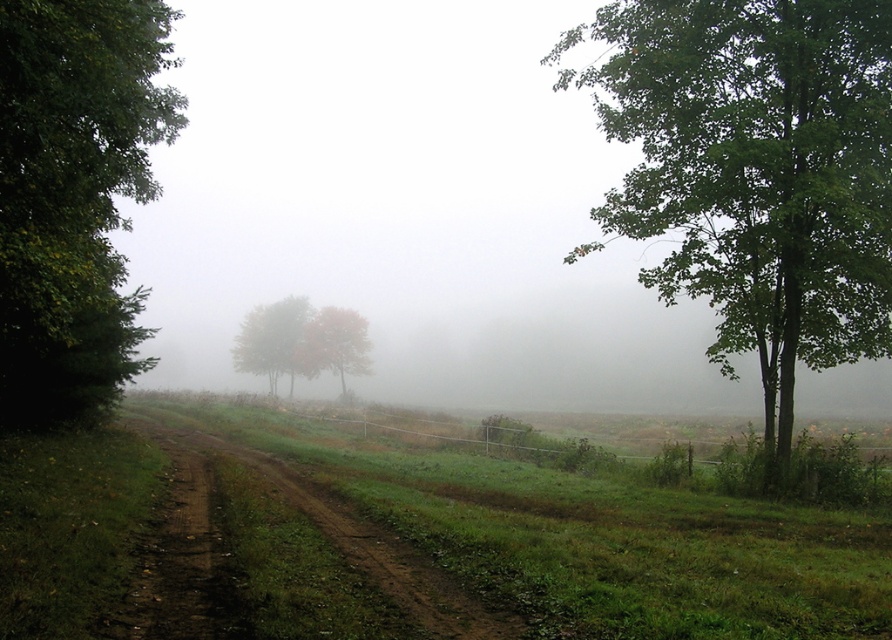
Question: Which object appears closest to the camera in this image?

Choices:
 (A) orange leafy tree at center
 (B) green leafy tree at left
 (C) green leafy tree at right

Answer: (B)

Question: Considering the real-world distances, which object is closest to the green leafy tree at left?

Choices:
 (A) green leafy tree at right
 (B) orange leafy tree at center

Answer: (A)

Question: Does green leafy tree at left appear over brown dirt track at center?

Choices:
 (A) yes
 (B) no

Answer: (A)

Question: Which point is closer to the camera?

Choices:
 (A) (622, 58)
 (B) (209, 541)
 (C) (304, 340)

Answer: (B)

Question: Does green leafy tree at right appear under autumn leaves tree at center?

Choices:
 (A) no
 (B) yes

Answer: (A)

Question: Is brown dirt track at center thinner than autumn leaves tree at center?

Choices:
 (A) yes
 (B) no

Answer: (A)